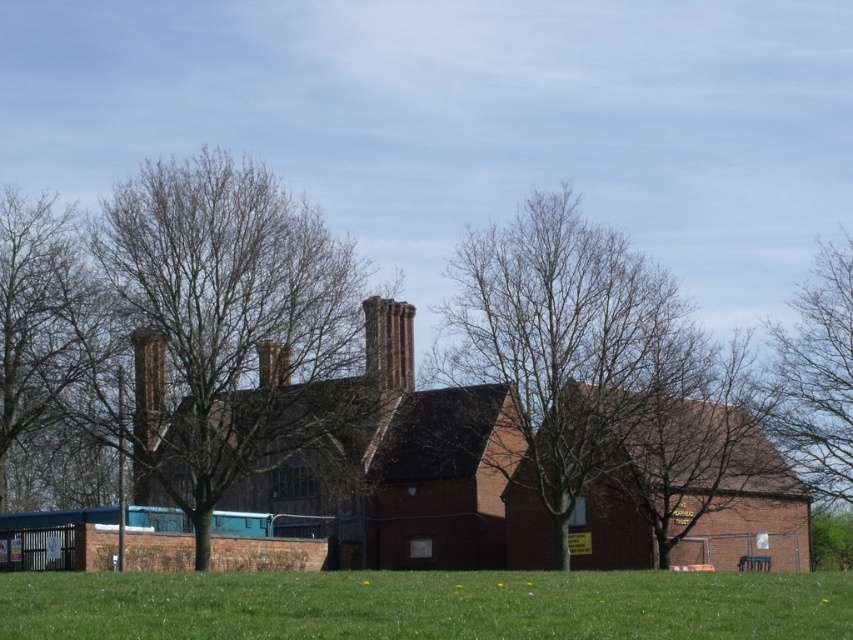
This screenshot has height=640, width=853. Identify the location of bare branches at left. (47, 355).

Does point (80, 465) lie in front of point (380, 317)?

No, (80, 465) is behind (380, 317).

This screenshot has width=853, height=640. Find the location of `bare branches at left`. bare branches at left is located at coordinates (47, 355).

Does bare branches at left have a greater width compared to smooth brick chimney at center-left?

Yes.

Between bare branches at left and smooth brick chimney at center-left, which one appears on the left side from the viewer's perspective?

bare branches at left

Is point (70, 337) closer to viewer compared to point (164, 356)?

No, (70, 337) is behind (164, 356).

Find the location of `bare branches at left`. bare branches at left is located at coordinates (47, 355).

Is bare branches at center closer to the viewer compared to bare branches at left?

No, bare branches at center is behind bare branches at left.

Does bare branches at center have a greater width compared to bare branches at left?

No.

Image resolution: width=853 pixels, height=640 pixels. What do you see at coordinates (567, 344) in the screenshot?
I see `bare branches at center` at bounding box center [567, 344].

What are the coordinates of `bare branches at center` in the screenshot? It's located at [567, 344].